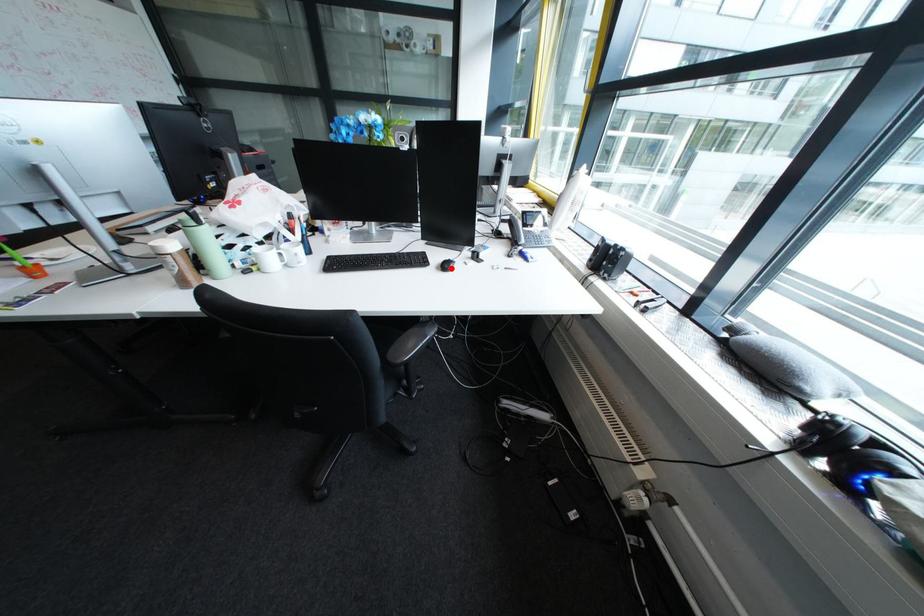
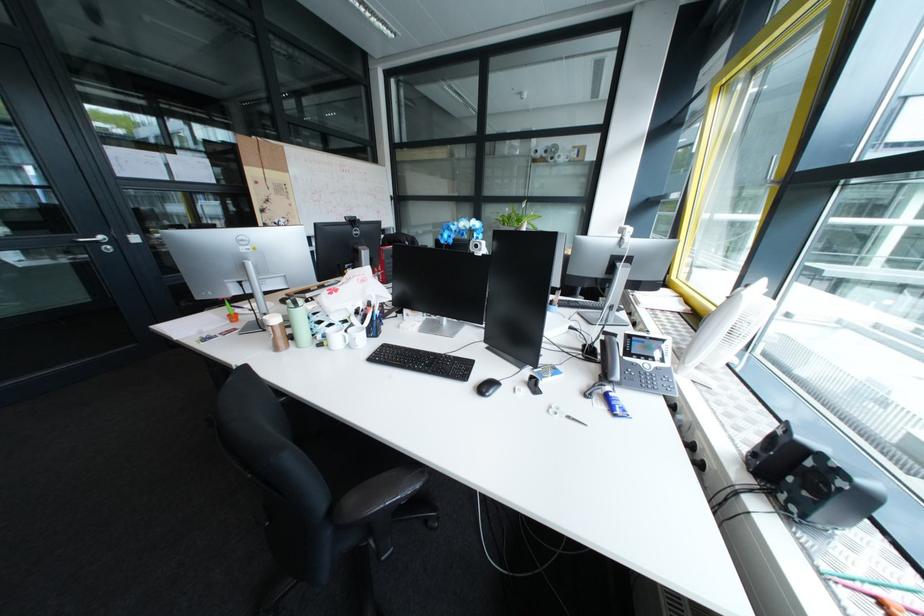
Question: I am providing you with two images of the same scene from different viewpoints. A red point is marked on the first image. Can you still see the location of the red point in image 2?

Choices:
 (A) Yes
 (B) No

Answer: (A)